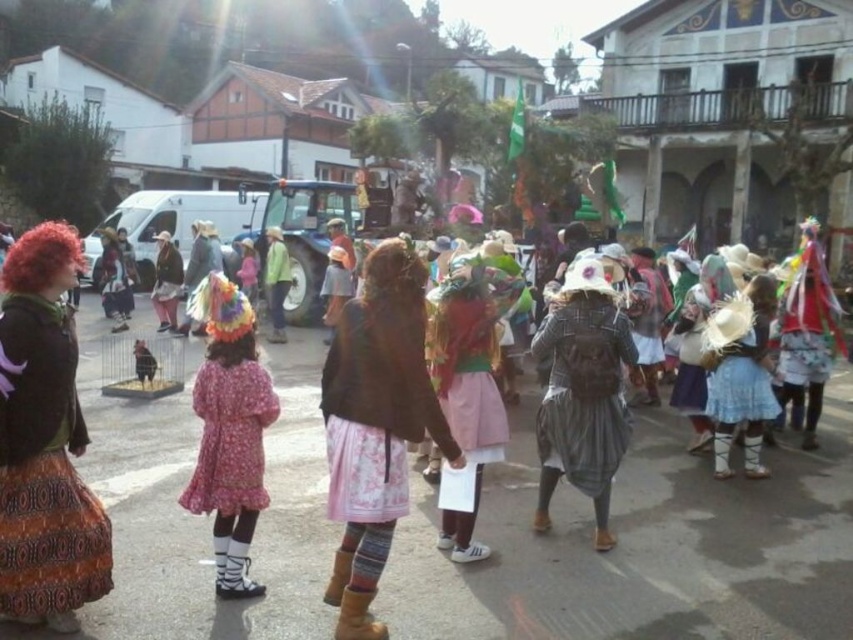
You are a photographer at the town square festival. You see two children wearing the pink floral dress at center and the multicolored fabric dress at right. Which child is standing to the left of the other?

The pink floral dress at center is positioned on the left side of multicolored fabric dress at right, so the child in the pink floral dress at center is standing to the left of the child in the multicolored fabric dress at right.